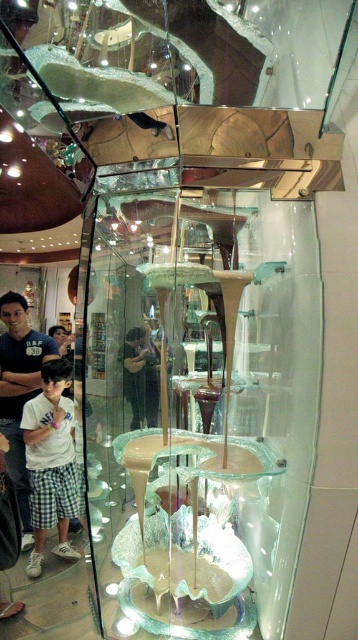
You are a photographer trying to capture the chocolate fountain display. You notice the white cotton shirt at center and the translucent glass bowl at center in your shot. Which object should you adjust your camera angle to focus on if you want to highlight the narrower object?

The white cotton shirt at center has a lesser width compared to the translucent glass bowl at center, so you should focus on the white cotton shirt at center to highlight the narrower object.

You are trying to decide which shirt to buy based on size. You see a white cotton shirt at left and a light blue shirt at center in the display. Which shirt is bigger?

The white cotton shirt at left is larger in size compared to the light blue shirt at center.

You are trying to decide which shirt to buy between the white cotton shirt at left and the light blue shirt at center. The store has a policy that only allows purchasing shirts wider than 50 cm. Can you determine which shirts meet the requirement?

The white cotton shirt at left is wider than the light blue shirt at center. Since the white cotton shirt at left has a larger width, it likely meets the 50 cm requirement, while the light blue shirt at center may not. However, without exact measurements, we can only compare their relative sizes.